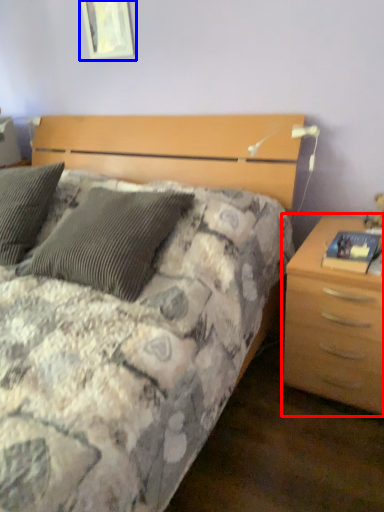
Question: Which point is closer to the camera, nightstand (highlighted by a red box) or picture frame (highlighted by a blue box)?

Choices:
 (A) nightstand
 (B) picture frame

Answer: (A)